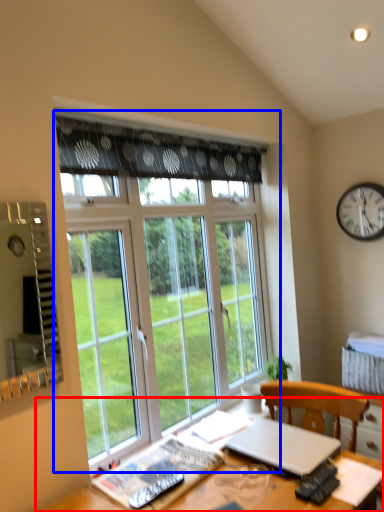
Question: Which of the following is the closest to the observer, desk (highlighted by a red box) or window (highlighted by a blue box)?

Choices:
 (A) desk
 (B) window

Answer: (A)